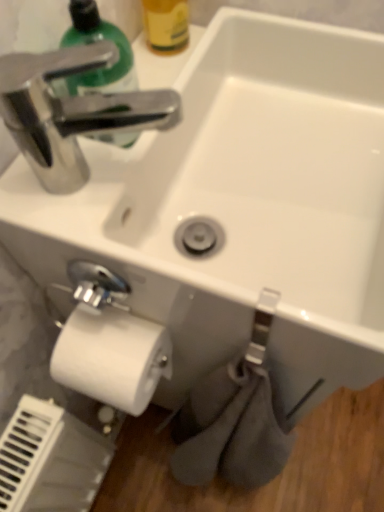
Identify the location of spots to the right of shiny green plastic soap dispenser at upper left. (190, 72).